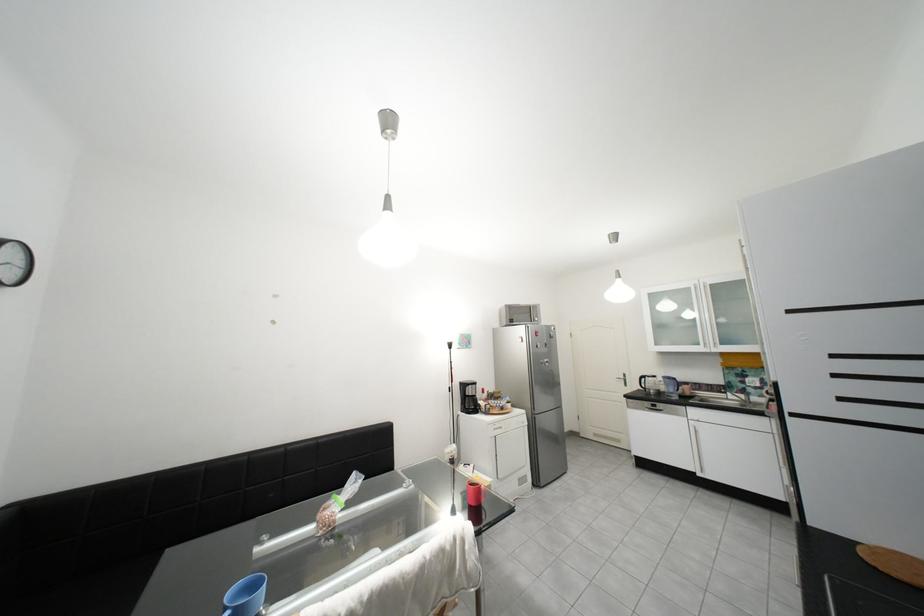
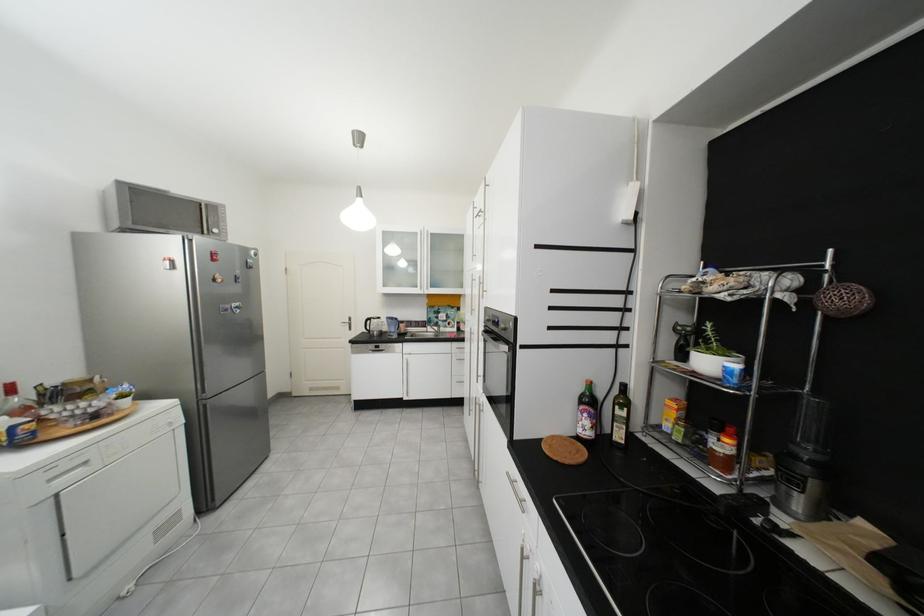
Find the pixel in the second image that matches (637,381) in the first image.

(361, 325)